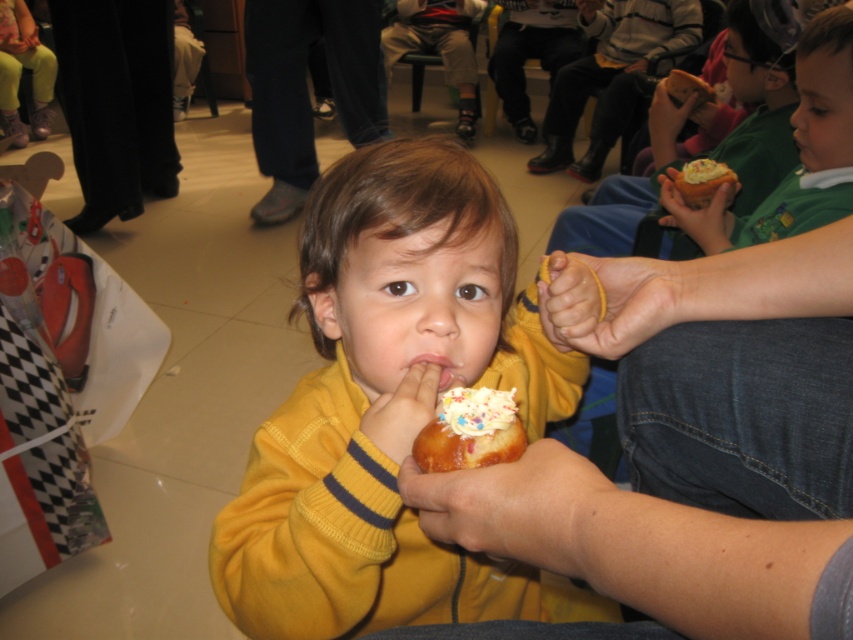
You are a food delivery robot that needs to deliver a dessert to a customer. The customer has specified they want the donut closest to the center of the image. Which donut should you choose between the glazed doughnut at center and the white frosted donut at upper right?

The glazed doughnut at center is closer to the center of the image than the white frosted donut at upper right, so you should choose the glazed doughnut at center.

You are standing in the room and want to move from the point closer to you to the point further away. Which path should you take to go from the point at point [256,561] to the point at point [828,49]?

You should move from point [256,561] to point [828,49] because point [256,561] is closer to the viewer and you need to go to the point further away.

Consider the image. You are organizing a clothing donation drive and need to sort items by size. You have two garments in front of you, the yellow soft sweater at center and the matte green shirt at upper right. Which one should you place in the large size bin?

The yellow soft sweater at center should be placed in the large size bin because it has a larger size compared to the matte green shirt at upper right.